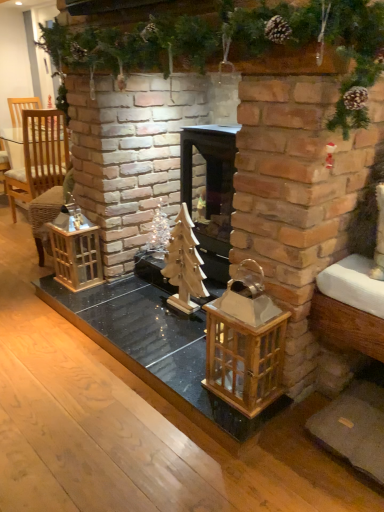
I want to click on space that is in front of wooden lantern at left, the 1th cage viewed from the back, so click(x=82, y=300).